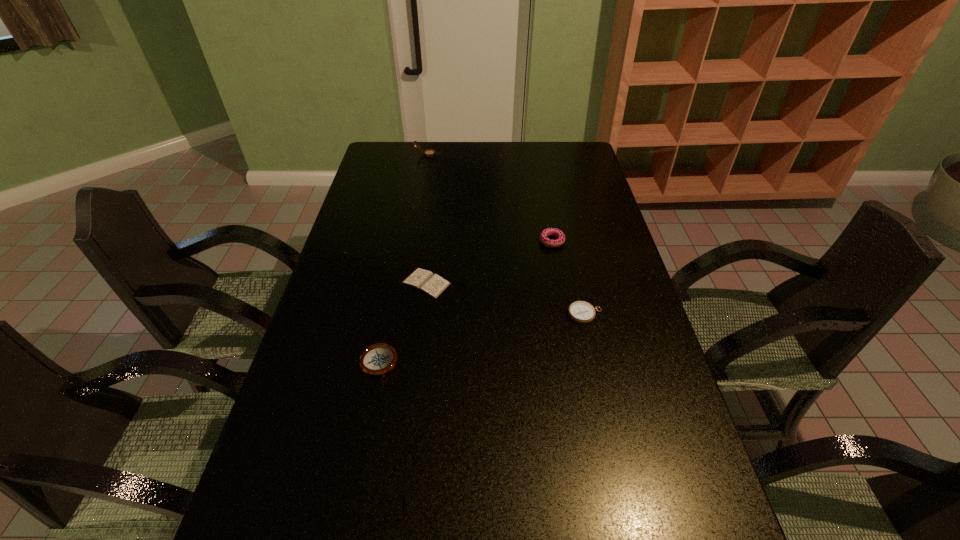
Identify the location of the tallest object. Image resolution: width=960 pixels, height=540 pixels. (428, 153).

What are the coordinates of `the farthest object` in the screenshot? It's located at pos(428,153).

Identify the location of the second farthest object. (551, 231).

The width and height of the screenshot is (960, 540). In order to click on the fourth shortest object in this screenshot , I will do `click(551, 231)`.

At what (x,y) coordinates should I click in order to perform the action: click on the third tallest object. Please return your answer as a coordinate pair (x, y). This screenshot has width=960, height=540. Looking at the image, I should click on (378, 359).

Locate an element on the screen. the nearest compass is located at coordinates (378, 359).

Where is `the rightmost compass`? the rightmost compass is located at coordinates (582, 312).

I want to click on the shortest compass, so click(582, 312).

Where is `the shortest object`? the shortest object is located at coordinates coord(433,285).

The width and height of the screenshot is (960, 540). I want to click on diary, so click(433, 285).